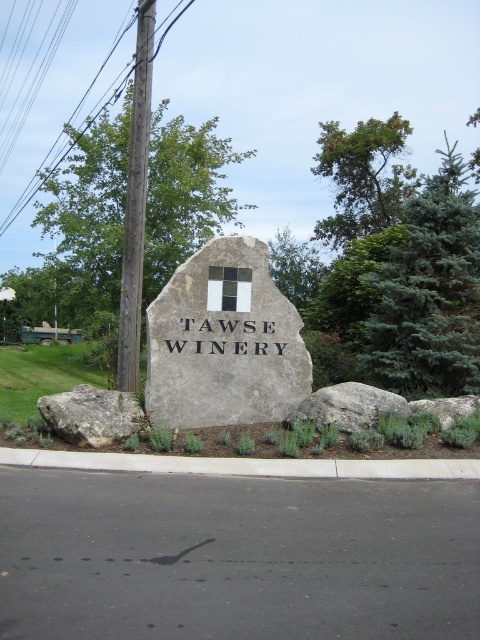
Question: Which point appears closest to the camera in this image?

Choices:
 (A) (241, 348)
 (B) (128, 248)

Answer: (A)

Question: Is wooden utility pole at left above gray rough rock at lower left?

Choices:
 (A) no
 (B) yes

Answer: (B)

Question: Which point is closer to the camera?

Choices:
 (A) gray rough rock at center
 (B) black stone sign at center

Answer: (A)

Question: Is wooden utility pole at left to the right of gray rough rock at lower left from the viewer's perspective?

Choices:
 (A) no
 (B) yes

Answer: (A)

Question: Is gray stone sign at center closer to camera compared to wooden utility pole at left?

Choices:
 (A) yes
 (B) no

Answer: (A)

Question: Which object is the closest to the black stone sign at center?

Choices:
 (A) white concrete curb at lower center
 (B) gray rock at center

Answer: (A)